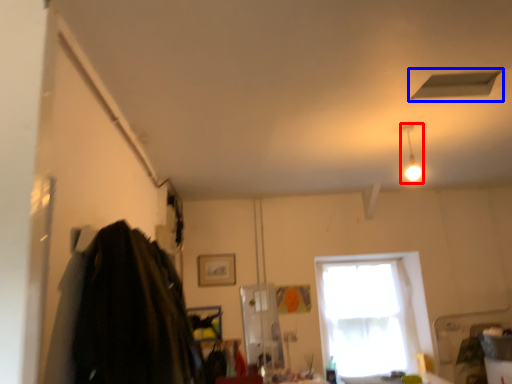
Question: Which point is closer to the camera, light fixture (highlighted by a red box) or exhaust hood (highlighted by a blue box)?

Choices:
 (A) light fixture
 (B) exhaust hood

Answer: (B)